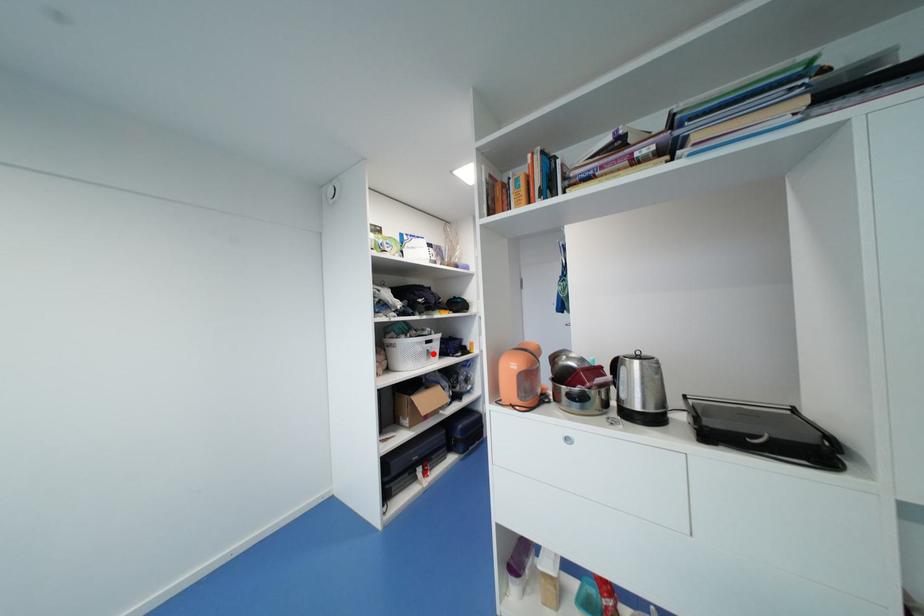
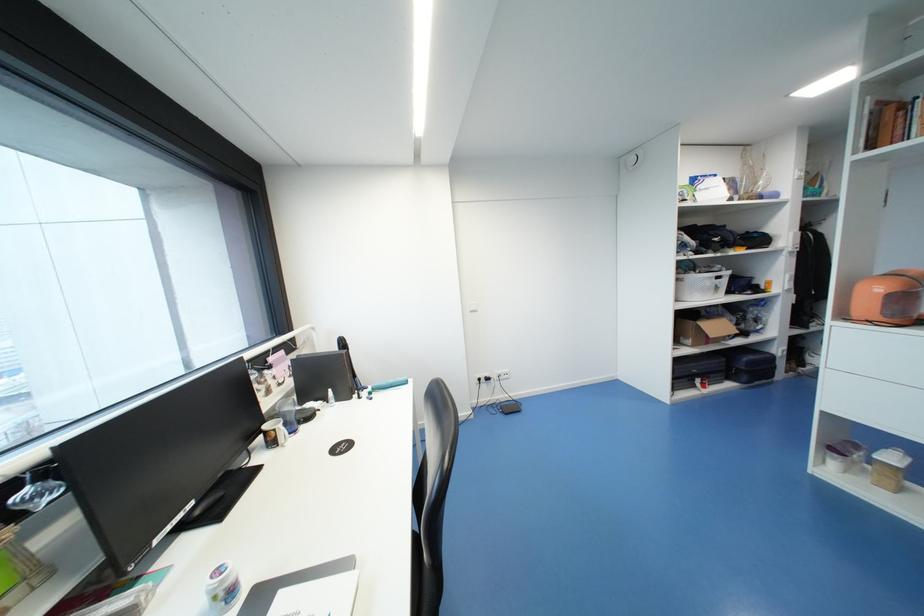
Find the pixel in the second image that matches the highlighted location in the first image.

(721, 288)